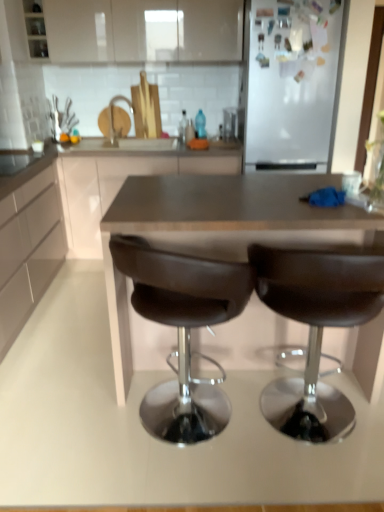
Where is `free spot in front of brushed metal faucet at upper center`? free spot in front of brushed metal faucet at upper center is located at coordinates (121, 145).